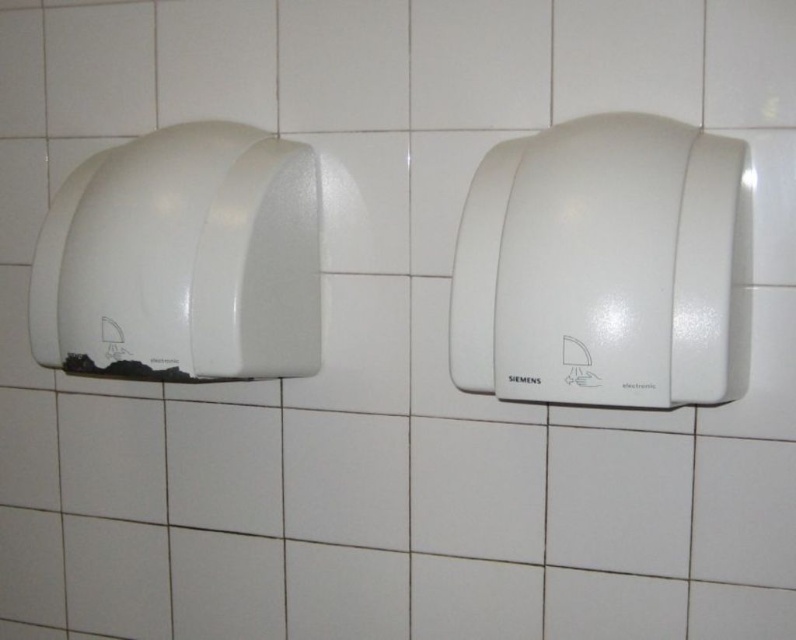
Is white plastic hand dryer at center behind white matte hand dryer at left?

No.

At what (x,y) coordinates should I click in order to perform the action: click on white plastic hand dryer at center. Please return your answer as a coordinate pair (x, y). This screenshot has height=640, width=796. Looking at the image, I should click on (605, 266).